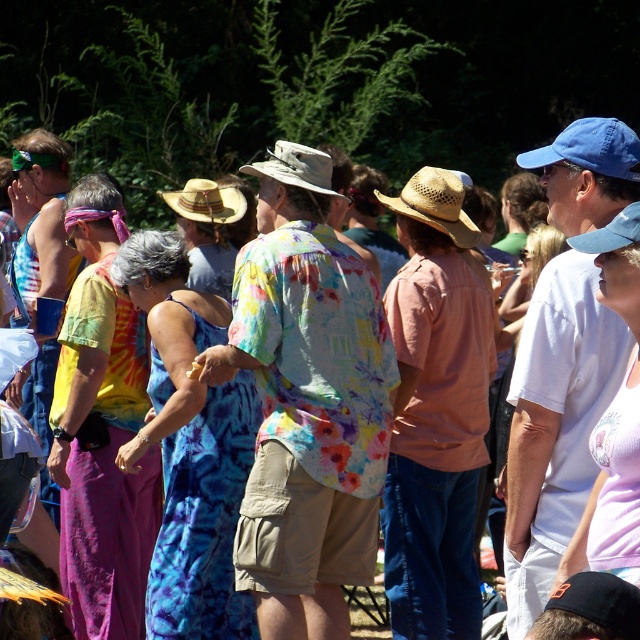
Is point (296, 180) behind point (234, 212)?

No, it is not.

Consider the image. Is camouflage fabric cowboy hat at center bigger than natural straw cowboy hat at center?

Actually, camouflage fabric cowboy hat at center might be smaller than natural straw cowboy hat at center.

At what (x,y) coordinates should I click in order to perform the action: click on camouflage fabric cowboy hat at center. Please return your answer as a coordinate pair (x, y). The height and width of the screenshot is (640, 640). Looking at the image, I should click on (296, 168).

At what (x,y) coordinates should I click in order to perform the action: click on camouflage fabric cowboy hat at center. Please return your answer as a coordinate pair (x, y). The width and height of the screenshot is (640, 640). Looking at the image, I should click on (296, 168).

Is strawmaterial/texturecowboy hat at center wider than camouflage fabric cowboy hat at center?

Correct, the width of strawmaterial/texturecowboy hat at center exceeds that of camouflage fabric cowboy hat at center.

Can you confirm if strawmaterial/texturecowboy hat at center is taller than camouflage fabric cowboy hat at center?

Correct, strawmaterial/texturecowboy hat at center is much taller as camouflage fabric cowboy hat at center.

Does point (458, 212) lie in front of point (292, 179)?

No, (458, 212) is further to viewer.

At what (x,y) coordinates should I click in order to perform the action: click on strawmaterial/texturecowboy hat at center. Please return your answer as a coordinate pair (x, y). The height and width of the screenshot is (640, 640). Looking at the image, I should click on (435, 204).

Is strawmaterial/texturecowboy hat at center below natural straw cowboy hat at center?

Indeed, strawmaterial/texturecowboy hat at center is positioned under natural straw cowboy hat at center.

Measure the distance from strawmaterial/texturecowboy hat at center to natural straw cowboy hat at center.

1.61 meters

Is point (440, 204) closer to viewer compared to point (212, 184)?

Yes, it is.

Locate an element on the screen. strawmaterial/texturecowboy hat at center is located at coordinates (435, 204).